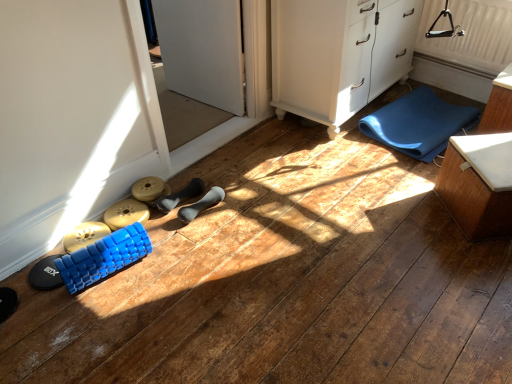
Measure the distance between blue textured foam roller at lower left, the third footwear in the right-to-left sequence, and camera.

They are 5.10 feet apart.

In order to face blue textured foam roller at lower left, placed as the 2th footwear when sorted from left to right, should I rotate leftwards or rightwards?

Turn left by 25.773 degrees to look at blue textured foam roller at lower left, placed as the 2th footwear when sorted from left to right.

The width and height of the screenshot is (512, 384). What do you see at coordinates (246, 88) in the screenshot? I see `white glossy door at center` at bounding box center [246, 88].

Describe the element at coordinates (338, 54) in the screenshot. I see `white glossy cabinet at center` at that location.

I want to click on white textured box at right, so click(478, 184).

Describe the element at coordinates (181, 195) in the screenshot. This screenshot has height=384, width=512. I see `matte gray dumbbell at center, acting as the third footwear starting from the left` at that location.

You are a GUI agent. You are given a task and a screenshot of the screen. Output one action in this format:
    pyautogui.click(x=<x>, y=<y>)
    Task: Click on the black fuzzy slipper at lower left, placed as the 4th footwear when sorted from right to left
    
    Given the screenshot: What is the action you would take?
    pyautogui.click(x=7, y=303)

You are a GUI agent. You are given a task and a screenshot of the screen. Output one action in this format:
    pyautogui.click(x=<x>, y=<y>)
    Task: Click on the blue textured foam roller at lower left, placed as the 2th footwear when sorted from left to right
    
    Given the screenshot: What is the action you would take?
    pyautogui.click(x=45, y=274)

From a real-world perspective, is blue foam roller at lower left, the 2th toy when ordered from back to front, physically located above or below black rubber shoe at center, acting as the 4th footwear starting from the left?

blue foam roller at lower left, the 2th toy when ordered from back to front, is above black rubber shoe at center, acting as the 4th footwear starting from the left.

Which object is more forward, blue foam roller at lower left, which ranks as the 1th toy in front-to-back order, or black rubber shoe at center, acting as the 4th footwear starting from the left?

blue foam roller at lower left, which ranks as the 1th toy in front-to-back order.

Based on the photo, is blue foam roller at lower left, which ranks as the 1th toy in front-to-back order, oriented towards black rubber shoe at center, placed as the 1th footwear when sorted from right to left?

No, blue foam roller at lower left, which ranks as the 1th toy in front-to-back order, is not aimed at black rubber shoe at center, placed as the 1th footwear when sorted from right to left.

Considering the sizes of objects blue foam roller at lower left, which ranks as the 1th toy in front-to-back order, and black rubber shoe at center, acting as the 4th footwear starting from the left, in the image provided, who is thinner, blue foam roller at lower left, which ranks as the 1th toy in front-to-back order, or black rubber shoe at center, acting as the 4th footwear starting from the left,?

black rubber shoe at center, acting as the 4th footwear starting from the left, is thinner.

What's the angular difference between white textured box at right and blue foam roller at lower left, the 2th toy when ordered from back to front,'s facing directions?

The angular difference between white textured box at right and blue foam roller at lower left, the 2th toy when ordered from back to front, is 121 degrees.

Is point (465, 216) positioned behind point (141, 246)?

Yes.

Where is `toy lying in front of the white textured box at right`? toy lying in front of the white textured box at right is located at coordinates (103, 257).

Which object is thinner, white textured box at right or blue foam roller at lower left, the 2th toy when ordered from back to front?

blue foam roller at lower left, the 2th toy when ordered from back to front, is thinner.

How far apart are blue textured foam roller at lower left, positioned as the first toy in back-to-front order, and blue rubber yoga mat at lower right?

The distance of blue textured foam roller at lower left, positioned as the first toy in back-to-front order, from blue rubber yoga mat at lower right is 5.00 feet.

Is the depth of blue textured foam roller at lower left, positioned as the first toy in back-to-front order, greater than that of blue rubber yoga mat at lower right?

No, blue textured foam roller at lower left, positioned as the first toy in back-to-front order, is in front of blue rubber yoga mat at lower right.

Is blue textured foam roller at lower left, which ranks as the second toy in front-to-back order, located outside blue rubber yoga mat at lower right?

Yes, blue textured foam roller at lower left, which ranks as the second toy in front-to-back order, is outside of blue rubber yoga mat at lower right.

From a real-world perspective, which object rests below the other?

In real-world perspective, blue textured foam roller at lower left, placed as the 2th footwear when sorted from left to right, is lower.

Looking at this image, is white textured radiator at upper right positioned in front of blue textured foam roller at lower left, placed as the 2th footwear when sorted from left to right?

No, white textured radiator at upper right is behind blue textured foam roller at lower left, placed as the 2th footwear when sorted from left to right.

From a real-world perspective, who is located lower, blue foam roller at lower left, the 2th toy when ordered from back to front, or white glossy cabinet at center?

blue foam roller at lower left, the 2th toy when ordered from back to front.

Considering the points (67, 284) and (369, 21), which point is in front, point (67, 284) or point (369, 21)?

The point (67, 284) is more forward.

Considering the relative sizes of blue foam roller at lower left, which ranks as the 1th toy in front-to-back order, and white glossy cabinet at center in the image provided, is blue foam roller at lower left, which ranks as the 1th toy in front-to-back order, shorter than white glossy cabinet at center?

Indeed, blue foam roller at lower left, which ranks as the 1th toy in front-to-back order, has a lesser height compared to white glossy cabinet at center.

Could you tell me if blue foam roller at lower left, which ranks as the 1th toy in front-to-back order, is turned towards white glossy cabinet at center?

No, blue foam roller at lower left, which ranks as the 1th toy in front-to-back order, is not facing towards white glossy cabinet at center.

Which object is positioned more to the right, blue textured foam roller at lower left, which ranks as the second toy in front-to-back order, or black rubber shoe at center, placed as the 1th footwear when sorted from right to left?

From the viewer's perspective, black rubber shoe at center, placed as the 1th footwear when sorted from right to left, appears more on the right side.

Considering the sizes of objects blue textured foam roller at lower left, positioned as the first toy in back-to-front order, and black rubber shoe at center, acting as the 4th footwear starting from the left, in the image provided, who is thinner, blue textured foam roller at lower left, positioned as the first toy in back-to-front order, or black rubber shoe at center, acting as the 4th footwear starting from the left,?

black rubber shoe at center, acting as the 4th footwear starting from the left.

Consider the image. From their relative heights in the image, would you say blue textured foam roller at lower left, positioned as the first toy in back-to-front order, is taller or shorter than black rubber shoe at center, acting as the 4th footwear starting from the left?

In the image, blue textured foam roller at lower left, positioned as the first toy in back-to-front order, appears to be shorter than black rubber shoe at center, acting as the 4th footwear starting from the left.

Which point is more distant from viewer, (122,221) or (219,200)?

The point (219,200) is farther.

Where is `the 1st toy positioned below the white glossy cabinet at center (from the image's perspective)`? Image resolution: width=512 pixels, height=384 pixels. the 1st toy positioned below the white glossy cabinet at center (from the image's perspective) is located at coordinates (126, 213).

Measure the distance between white glossy cabinet at center and blue textured foam roller at lower left, positioned as the first toy in back-to-front order.

They are 1.27 meters apart.

Based on the photo, from a real-world perspective, who is located higher, white glossy cabinet at center or blue textured foam roller at lower left, which ranks as the second toy in front-to-back order?

white glossy cabinet at center is physically above.

Is white glossy cabinet at center aimed at blue textured foam roller at lower left, which ranks as the second toy in front-to-back order?

No, white glossy cabinet at center is not facing towards blue textured foam roller at lower left, which ranks as the second toy in front-to-back order.

At what (x,y) coordinates should I click in order to perform the action: click on the 2nd toy to the left of the black rubber shoe at center, placed as the 1th footwear when sorted from right to left, counting from the anchor's position. Please return your answer as a coordinate pair (x, y). The height and width of the screenshot is (384, 512). Looking at the image, I should click on (103, 257).

Find the location of a particular element. This screenshot has width=512, height=384. furniture above the blue foam roller at lower left, which ranks as the 1th toy in front-to-back order (from the image's perspective) is located at coordinates (478, 184).

In the scene shown: Which object lies nearer to the anchor point matte gray dumbbell at center, acting as the third footwear starting from the left, blue rubber yoga mat at lower right or black fuzzy slipper at lower left, arranged as the first footwear when viewed from the left?

Among the two, black fuzzy slipper at lower left, arranged as the first footwear when viewed from the left, is located nearer to matte gray dumbbell at center, acting as the third footwear starting from the left.

Based on their spatial positions, is blue rubber yoga mat at lower right or blue foam roller at lower left, which ranks as the 1th toy in front-to-back order, further from black fuzzy slipper at lower left, arranged as the first footwear when viewed from the left?

The object further to black fuzzy slipper at lower left, arranged as the first footwear when viewed from the left, is blue rubber yoga mat at lower right.

Estimate the real-world distances between objects in this image. Which object is further from blue textured foam roller at lower left, placed as the 2th footwear when sorted from left to right, white textured box at right or white textured radiator at upper right?

white textured radiator at upper right is positioned further to the anchor blue textured foam roller at lower left, placed as the 2th footwear when sorted from left to right.

Based on their spatial positions, is blue rubber yoga mat at lower right or white glossy cabinet at center further from white textured radiator at upper right?

Based on the image, white glossy cabinet at center appears to be further to white textured radiator at upper right.

Looking at the image, which one is located closer to blue rubber yoga mat at lower right, black fuzzy slipper at lower left, placed as the 4th footwear when sorted from right to left, or blue textured foam roller at lower left, placed as the 2th footwear when sorted from left to right?

blue textured foam roller at lower left, placed as the 2th footwear when sorted from left to right, lies closer to blue rubber yoga mat at lower right than the other object.

From the image, which object appears to be farther from black rubber shoe at center, placed as the 1th footwear when sorted from right to left, black fuzzy slipper at lower left, placed as the 4th footwear when sorted from right to left, or blue textured foam roller at lower left, which ranks as the second toy in front-to-back order?

Based on the image, black fuzzy slipper at lower left, placed as the 4th footwear when sorted from right to left, appears to be further to black rubber shoe at center, placed as the 1th footwear when sorted from right to left.

Looking at the image, which one is located closer to black rubber shoe at center, placed as the 1th footwear when sorted from right to left, white glossy cabinet at center or blue foam roller at lower left, the 2th toy when ordered from back to front?

blue foam roller at lower left, the 2th toy when ordered from back to front, lies closer to black rubber shoe at center, placed as the 1th footwear when sorted from right to left, than the other object.

Which object lies nearer to the anchor point blue foam roller at lower left, which ranks as the 1th toy in front-to-back order, blue rubber yoga mat at lower right or black fuzzy slipper at lower left, arranged as the first footwear when viewed from the left?

black fuzzy slipper at lower left, arranged as the first footwear when viewed from the left, is closer to blue foam roller at lower left, which ranks as the 1th toy in front-to-back order.

Find the location of `yoga mat between blue textured foam roller at lower left, positioned as the first toy in back-to-front order, and white textured box at right`. yoga mat between blue textured foam roller at lower left, positioned as the first toy in back-to-front order, and white textured box at right is located at coordinates (418, 123).

I want to click on the chest of drawers located between blue foam roller at lower left, which ranks as the 1th toy in front-to-back order, and white textured radiator at upper right in the left-right direction, so click(x=338, y=54).

What are the coordinates of `footwear that lies between white glossy cabinet at center and black rubber shoe at center, acting as the 4th footwear starting from the left, from top to bottom` in the screenshot? It's located at (181, 195).

Where is `chest of drawers between blue foam roller at lower left, which ranks as the 1th toy in front-to-back order, and blue rubber yoga mat at lower right`? The image size is (512, 384). chest of drawers between blue foam roller at lower left, which ranks as the 1th toy in front-to-back order, and blue rubber yoga mat at lower right is located at coordinates (338, 54).